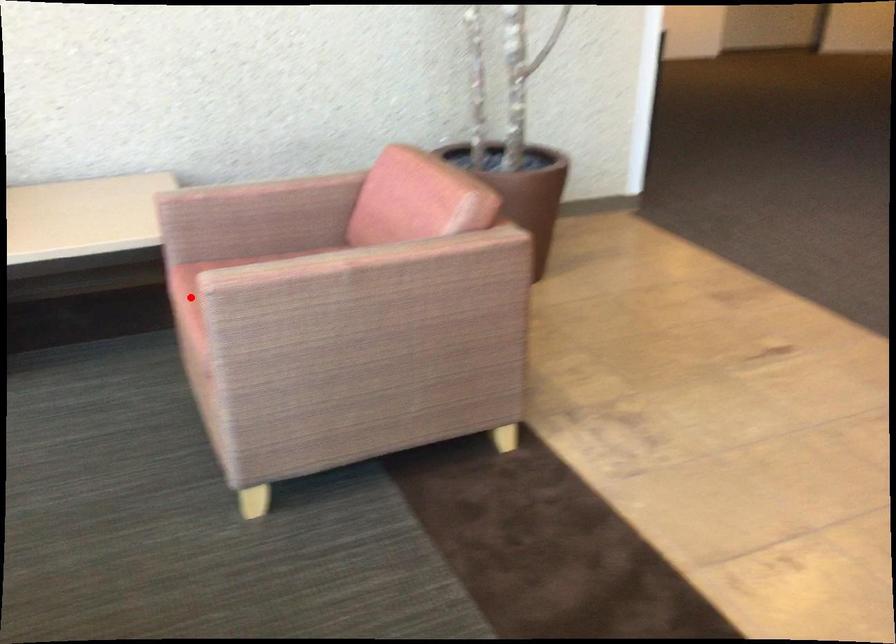
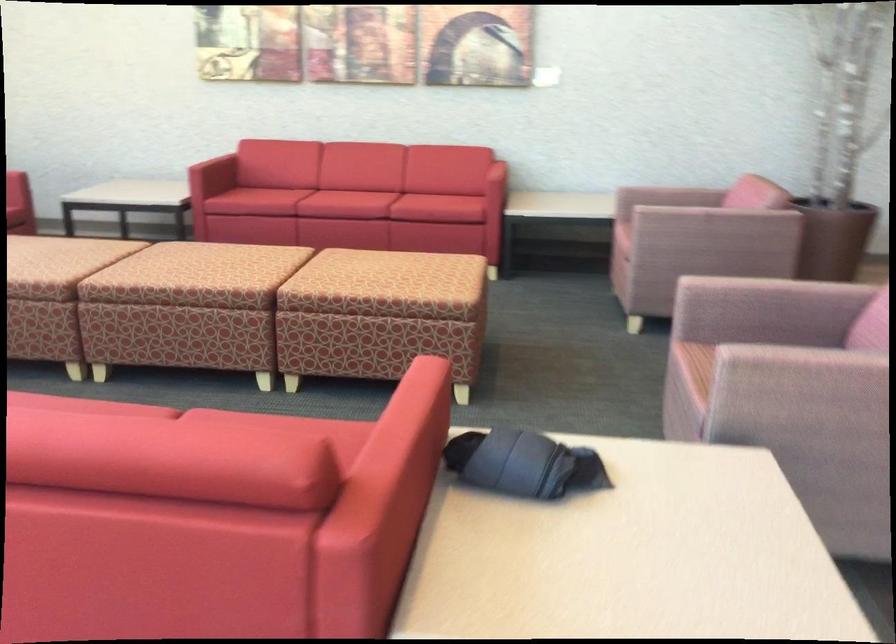
In the second image, find the point that corresponds to the highlighted location in the first image.

(624, 218)